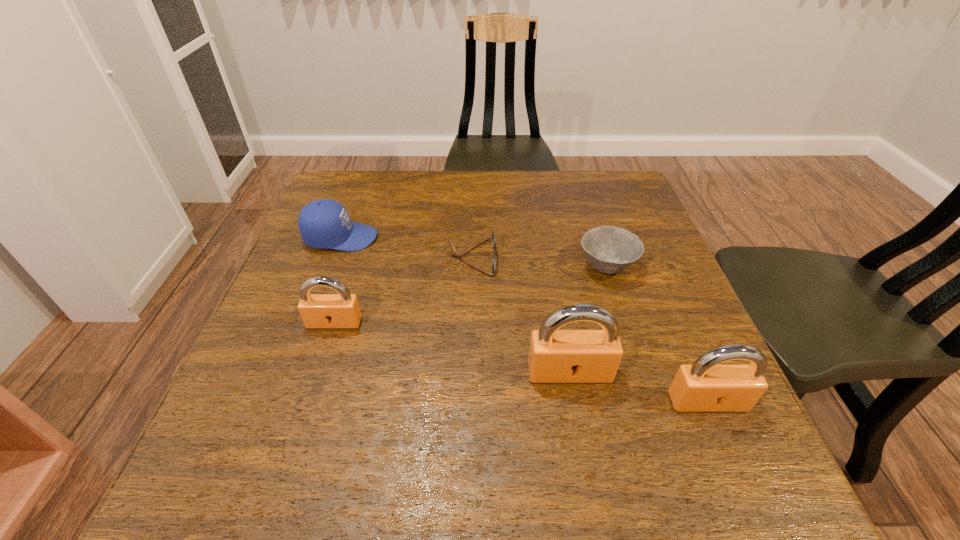
In the image, there is a desktop. Where is `vacant space at the far edge`? Image resolution: width=960 pixels, height=540 pixels. vacant space at the far edge is located at coordinates (461, 215).

In the image, there is a desktop. Where is `vacant space at the near edge`? vacant space at the near edge is located at coordinates (343, 431).

Locate an element on the screen. The image size is (960, 540). free space at the left edge of the desktop is located at coordinates (368, 217).

Locate an element on the screen. The width and height of the screenshot is (960, 540). free space at the right edge is located at coordinates (683, 318).

You are a GUI agent. You are given a task and a screenshot of the screen. Output one action in this format:
    pyautogui.click(x=<x>, y=<y>)
    Task: Click on the vacant space at the far right corner of the desktop
    
    Given the screenshot: What is the action you would take?
    pyautogui.click(x=599, y=170)

The height and width of the screenshot is (540, 960). In order to click on vacant area between the third tallest object and the second farthest padlock in this screenshot , I will do `click(452, 347)`.

Identify the location of unoccupied area between the shortest object and the third shortest object. (407, 248).

Identify the location of unoccupied area between the second farthest padlock and the spectacles. (521, 315).

Image resolution: width=960 pixels, height=540 pixels. I want to click on empty space that is in between the fourth tallest object and the bowl, so click(474, 252).

The image size is (960, 540). I want to click on blank region between the second tallest object and the second farthest padlock, so click(638, 387).